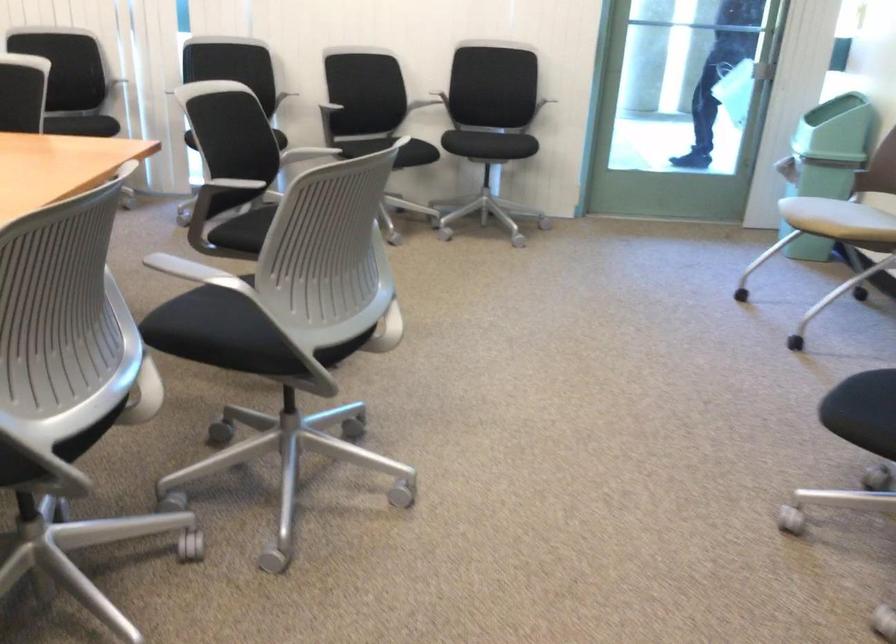
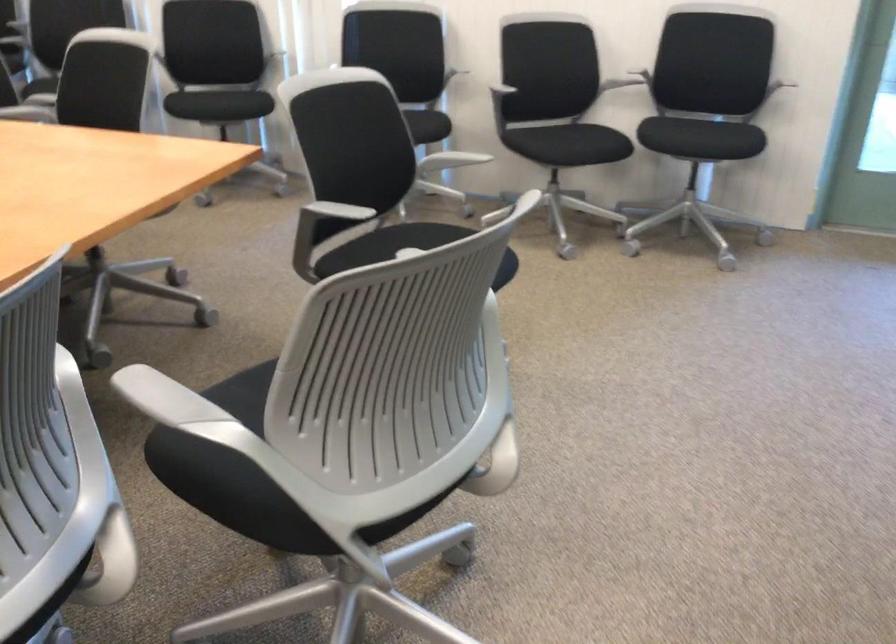
Find the pixel in the second image that matches point (444, 93) in the first image.

(638, 79)